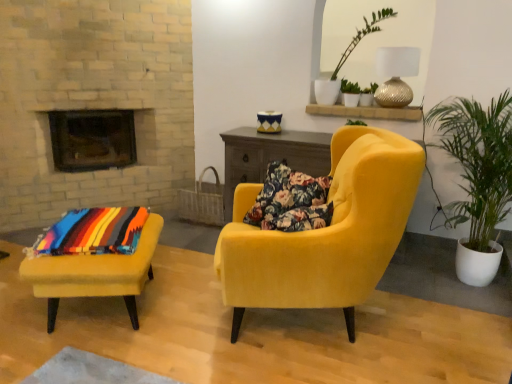
At what (x,y) coordinates should I click in order to perform the action: click on vacant region in front of velvet yellow ottoman at lower left, which is the 1th chair in left-to-right order. Please return your answer as a coordinate pair (x, y). Looking at the image, I should click on (85, 359).